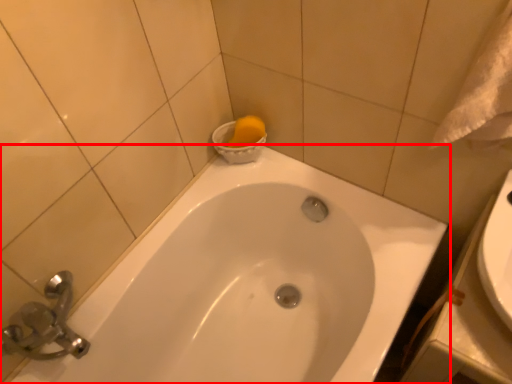
Question: Considering the relative positions of bathtub (annotated by the red box) and bath towel in the image provided, where is bathtub (annotated by the red box) located with respect to the staircase?

Choices:
 (A) left
 (B) right

Answer: (A)